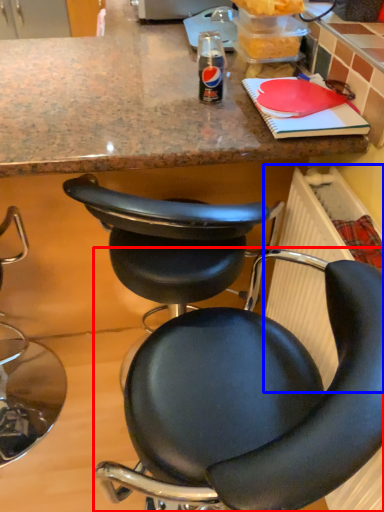
Question: Which object is closer to the camera taking this photo, chair (highlighted by a red box) or radiator (highlighted by a blue box)?

Choices:
 (A) chair
 (B) radiator

Answer: (A)